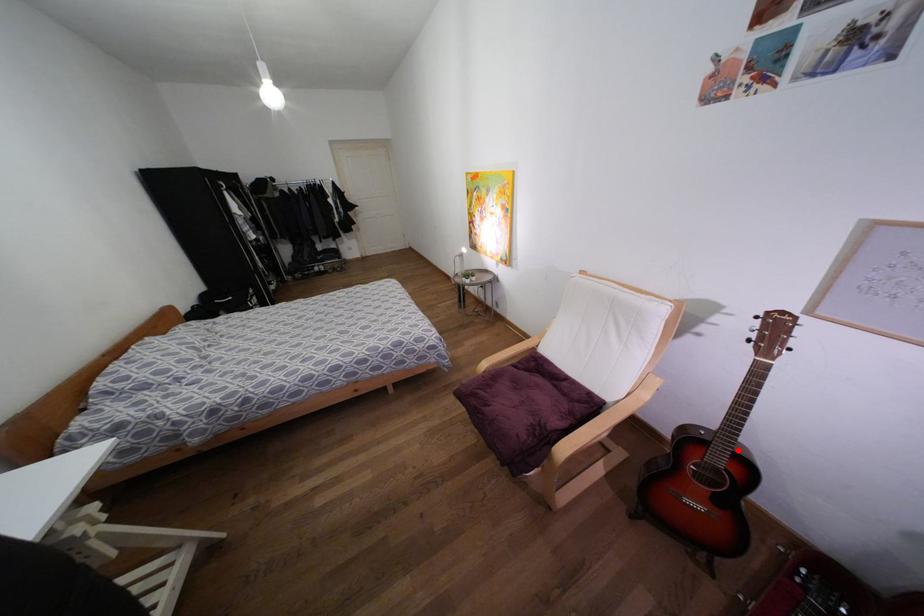
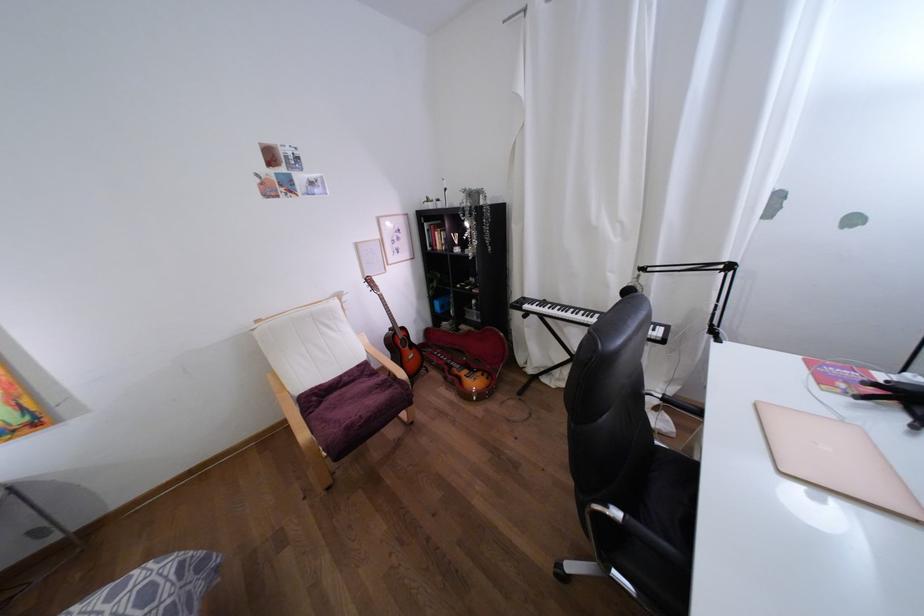
Question: A red point is marked in image1. In image2, is the corresponding 3D point closer to the camera or farther? Reply with the corresponding letter.

Choices:
 (A) The corresponding 3D point is closer.
 (B) The corresponding 3D point is farther.

Answer: (A)